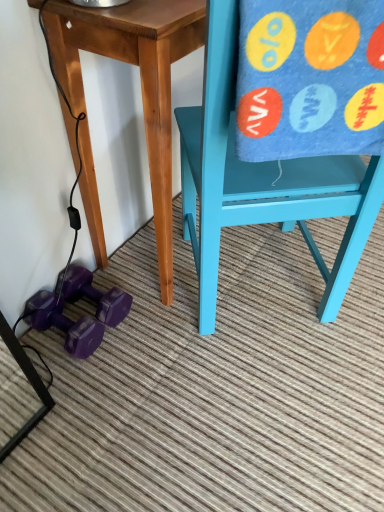
I want to click on free region under matte blue chair at right (from a real-world perspective), so click(264, 289).